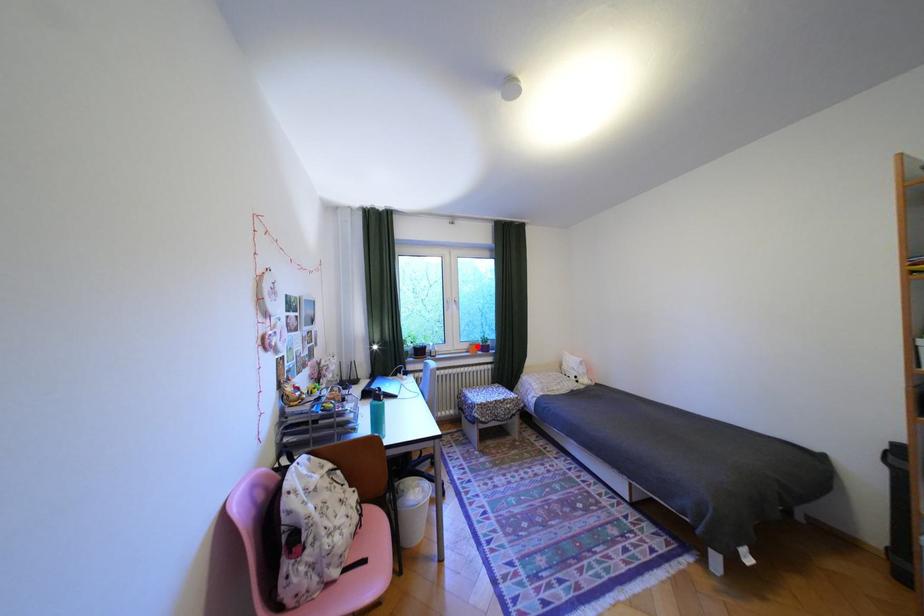
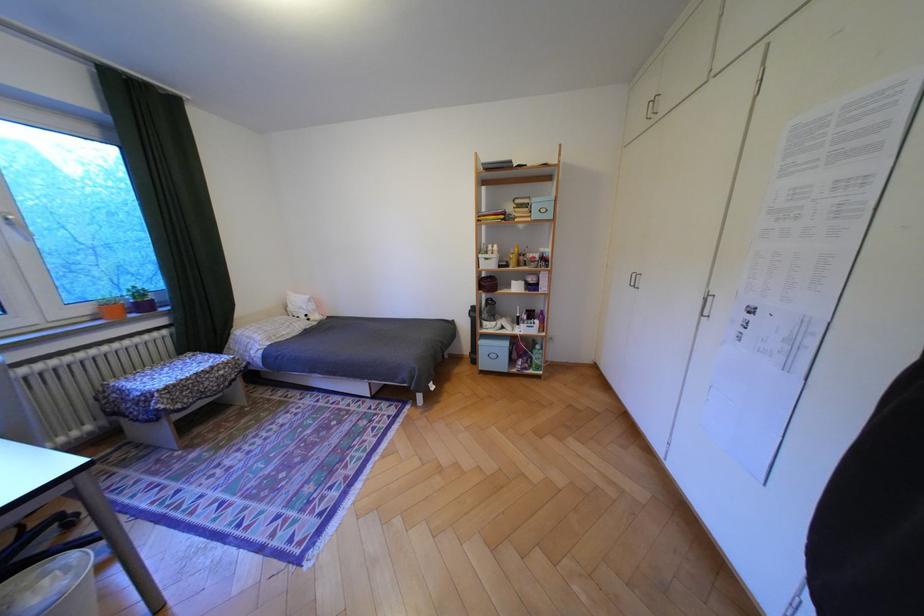
Locate, in the second image, the point that corresponds to the highlighted location in the first image.

(99, 310)